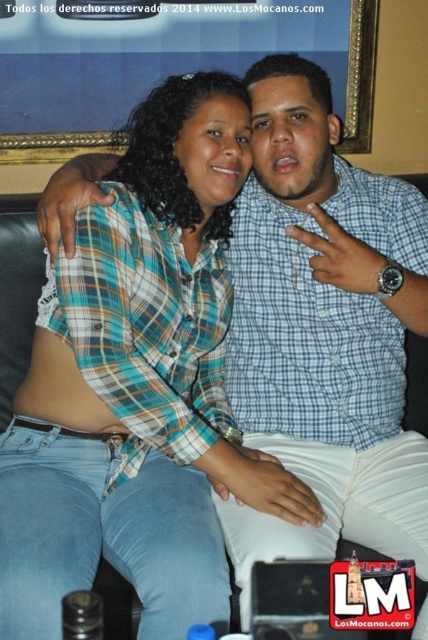
Is blue plaid shirt at center to the right of blue checkered shirt at center from the viewer's perspective?

In fact, blue plaid shirt at center is to the left of blue checkered shirt at center.

Which of these two, blue plaid shirt at center or blue checkered shirt at center, stands shorter?

Standing shorter between the two is blue plaid shirt at center.

You are a GUI agent. You are given a task and a screenshot of the screen. Output one action in this format:
    pyautogui.click(x=<x>, y=<y>)
    Task: Click on the blue plaid shirt at center
    
    Given the screenshot: What is the action you would take?
    pyautogui.click(x=139, y=387)